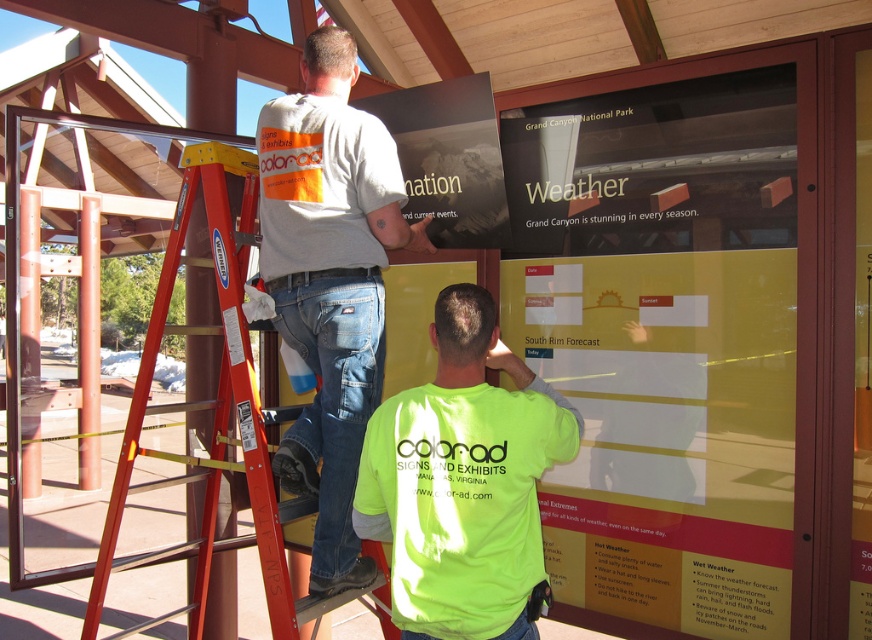
In the scene shown: You are a visitor standing at the entrance of the wooden structure. You see the neon green shirt at center and the red metal ladder at left. Which object is nearer to you?

The neon green shirt at center is closer to the viewer than the red metal ladder at left.

You are a visitor at the site and want to take a photo of the neon green shirt at center without including the red metal ladder at left in the frame. Is this possible given their distance?

The neon green shirt at center is 29.19 inches away from the red metal ladder at left. Since the distance between them is relatively close, it might be challenging to frame the photo to exclude the ladder without cropping the shirt, but it depends on the camera angle and lens used.

In the scene shown: You are a visitor trying to take a photo of the informational sign without blocking the workers. Since you want to avoid the white cotton shirt at upper center and the red metal ladder at left, which object should you move closer to in order to minimize their appearance in your frame?

The white cotton shirt at upper center has a smaller width compared to the red metal ladder at left, so moving closer to the white cotton shirt at upper center would help reduce both their presence in the photo frame more effectively.